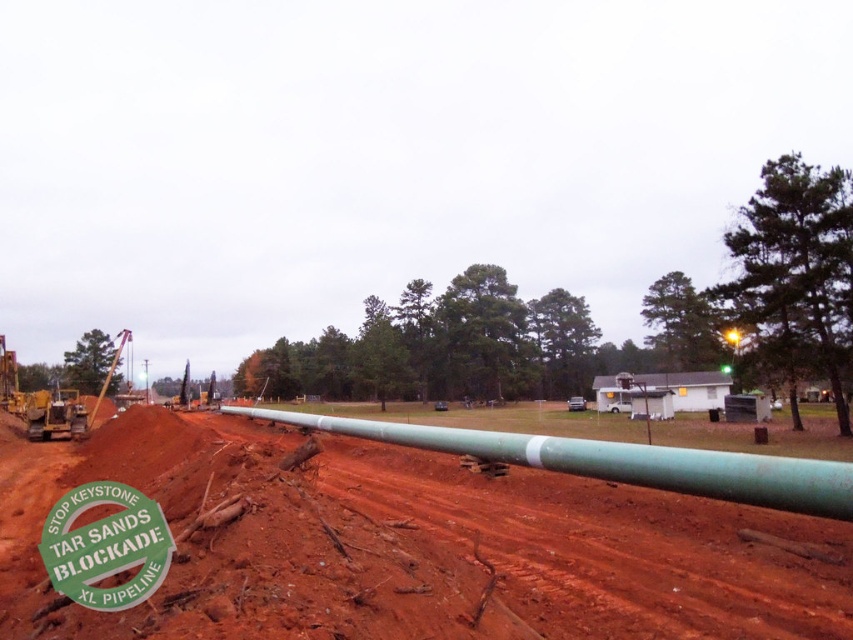
In the scene shown: Which is more to the left, red clay dirt at center or green matte pipe at center?

From the viewer's perspective, red clay dirt at center appears more on the left side.

Who is more forward, (281,616) or (543,438)?

Point (281,616) is more forward.

This screenshot has height=640, width=853. In order to click on red clay dirt at center in this screenshot , I will do `click(413, 545)`.

Between point (376, 580) and point (107, 529), which one is positioned in front?

Point (107, 529) is in front.

Find the location of `red clay dirt at center`. red clay dirt at center is located at coordinates (413, 545).

Can you confirm if green matte pipe at center is smaller than green paper sign at lower left?

No, green matte pipe at center is not smaller than green paper sign at lower left.

Does point (840, 497) lie behind point (53, 557)?

Yes, it is.

I want to click on green matte pipe at center, so click(614, 461).